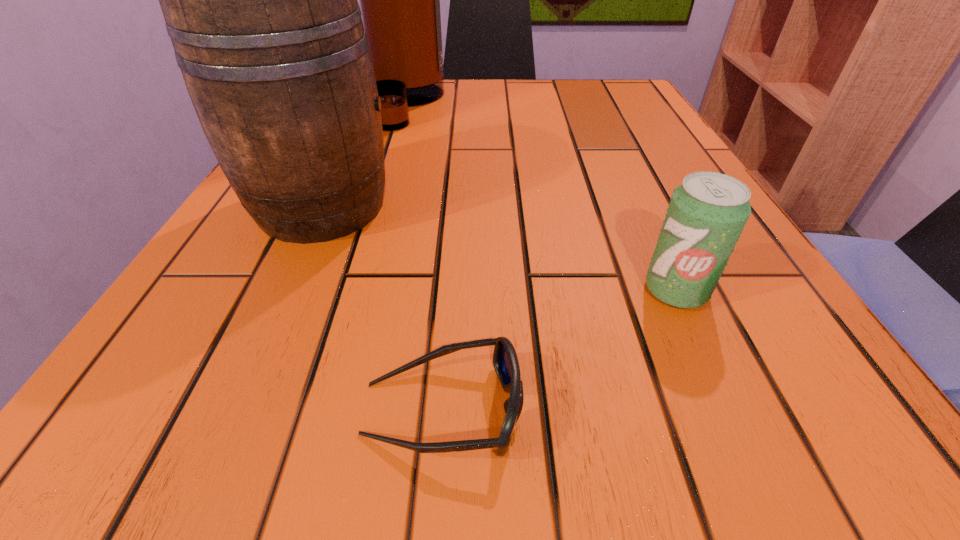
At what (x,y) coordinates should I click in order to perform the action: click on free space located 0.110m on the left of the second shortest object. Please return your answer as a coordinate pair (x, y). Looking at the image, I should click on (557, 290).

Where is `free location located 0.320m on the front-facing side of the nearest object`? free location located 0.320m on the front-facing side of the nearest object is located at coordinates (845, 409).

Where is `object at the far edge`? object at the far edge is located at coordinates (399, 0).

Where is `object that is at the near edge`? Image resolution: width=960 pixels, height=540 pixels. object that is at the near edge is located at coordinates (505, 361).

At what (x,y) coordinates should I click in order to perform the action: click on liquor situated at the left edge. Please return your answer as a coordinate pair (x, y). The height and width of the screenshot is (540, 960). Looking at the image, I should click on (399, 0).

Identify the location of cider present at the left edge. (260, 1).

Locate an element on the screen. Image resolution: width=960 pixels, height=540 pixels. object situated at the right edge is located at coordinates (707, 213).

At what (x,y) coordinates should I click in order to perform the action: click on object that is at the far left corner. Please return your answer as a coordinate pair (x, y). This screenshot has width=960, height=540. Looking at the image, I should click on (399, 0).

Find the location of a particular element. vacant space at the far edge of the desktop is located at coordinates (529, 97).

This screenshot has height=540, width=960. In the image, there is a desktop. Find the location of `free region at the near edge`. free region at the near edge is located at coordinates (692, 434).